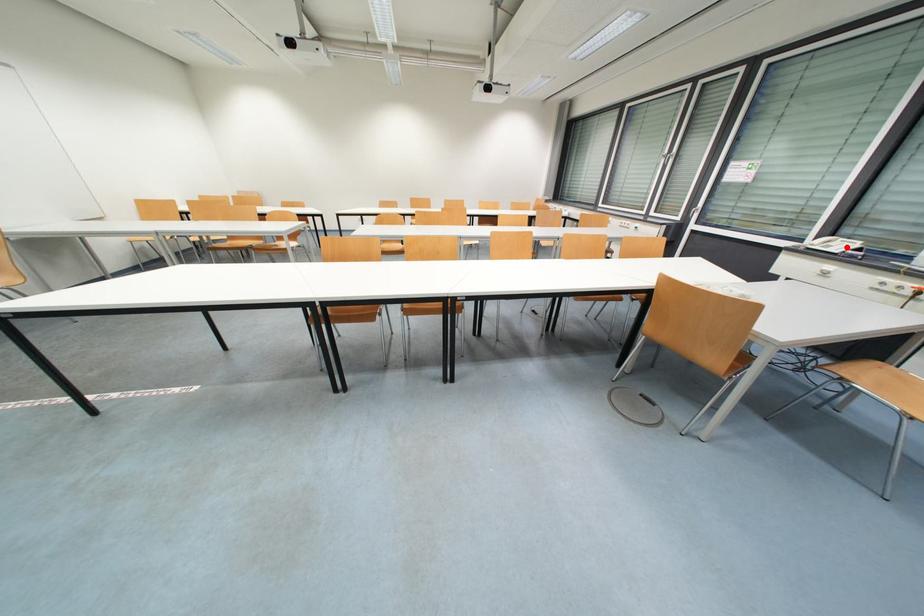
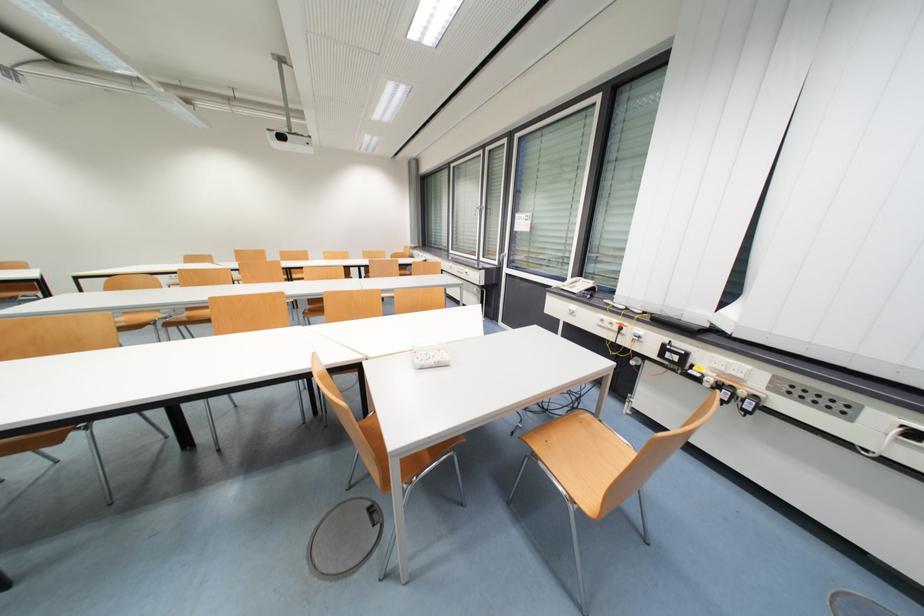
Where in the second image is the point corresponding to the highlighted location from the first image?

(587, 286)